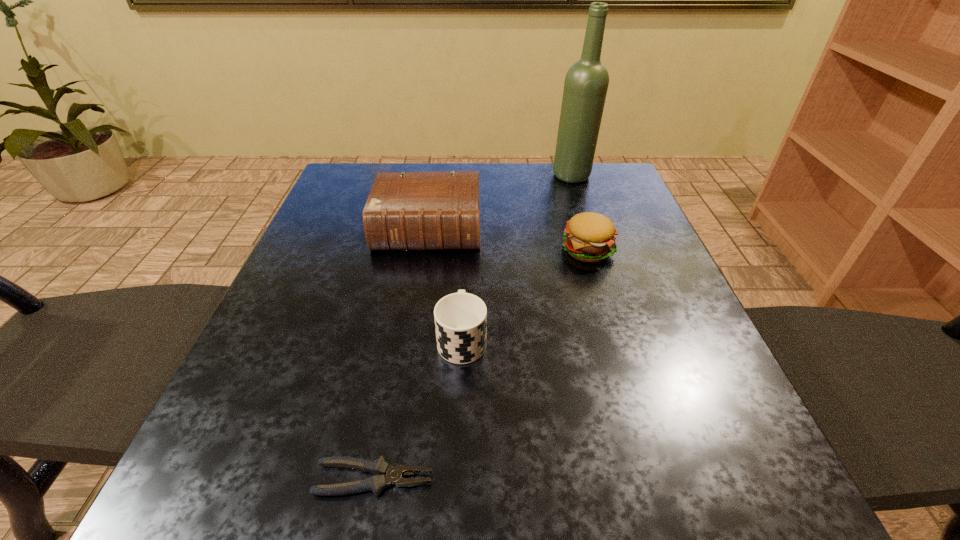
This screenshot has height=540, width=960. I want to click on free location located 0.060m on the side of the cup with the handle, so click(x=464, y=293).

This screenshot has height=540, width=960. Identify the location of free space located on the side of the cup with the handle. (468, 207).

Where is `vacant region located 0.210m on the left of the hamburger`? The height and width of the screenshot is (540, 960). vacant region located 0.210m on the left of the hamburger is located at coordinates pyautogui.click(x=461, y=249).

What are the coordinates of `free spot located 0.290m at the gripping part of the nearest object` in the screenshot? It's located at 658,479.

The image size is (960, 540). I want to click on wine bottle present at the far edge, so click(586, 83).

Find the location of a particular element. Bible at the far edge is located at coordinates [405, 211].

The width and height of the screenshot is (960, 540). Identify the location of object located in the near edge section of the desktop. (378, 482).

You are a GUI agent. You are given a task and a screenshot of the screen. Output one action in this format:
    pyautogui.click(x=<x>, y=<y>)
    Task: Click on the object that is positioned at the left edge
    
    Given the screenshot: What is the action you would take?
    click(x=405, y=211)

Locate an element on the screen. This screenshot has width=960, height=540. wine bottle situated at the right edge is located at coordinates (586, 83).

Where is `hamburger that is at the right edge`? hamburger that is at the right edge is located at coordinates (589, 237).